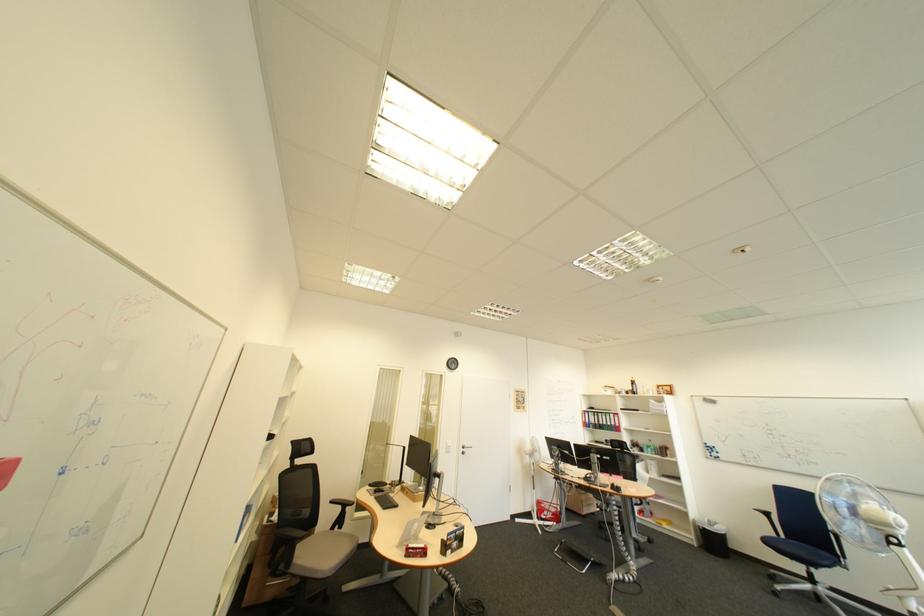
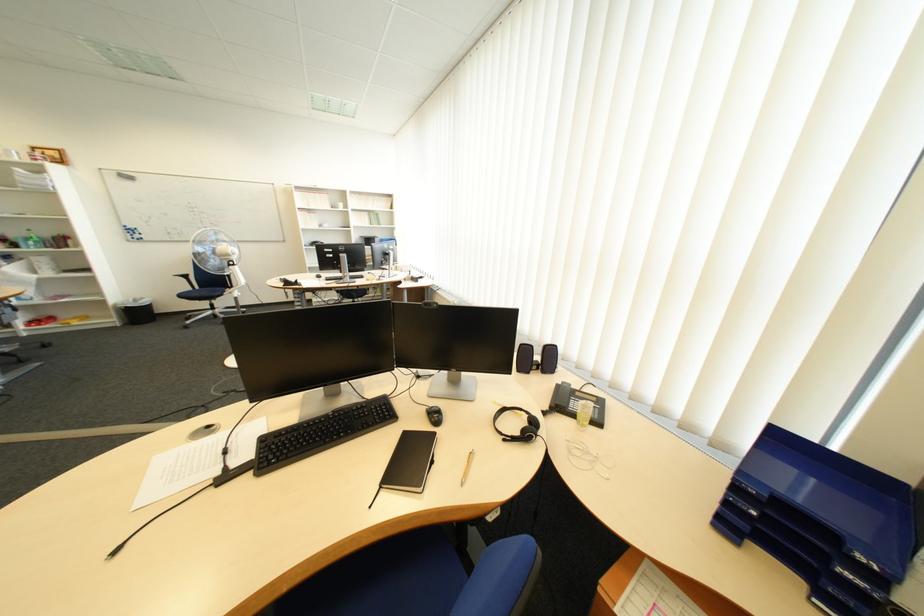
Find the pixel in the second image that matches point 723,524 in the first image.

(149, 302)